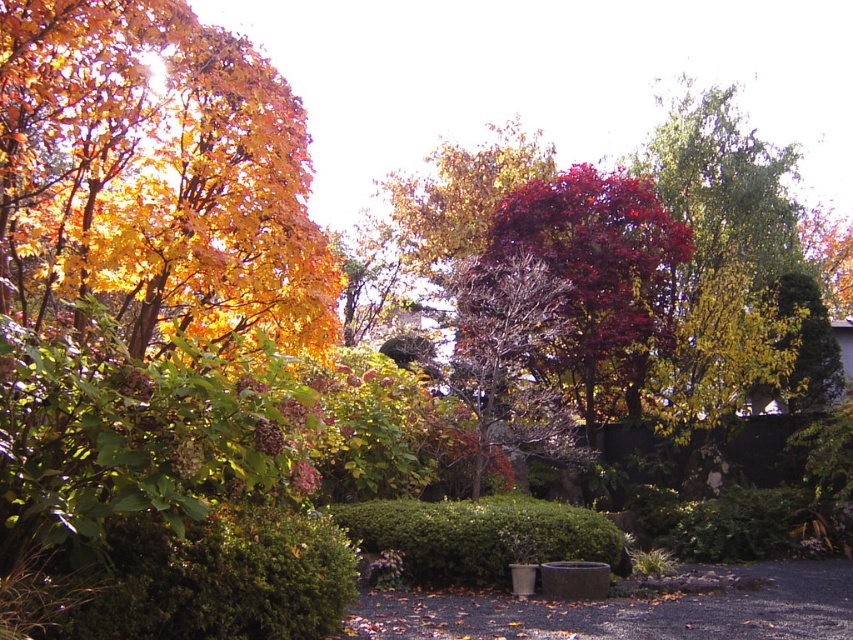
You are a gardener planning to install a new sprinkler system in the garden. The sprinkler has a maximum range of 10 feet. Given the green textured hedge at lower left and the green matte hedge at center, can the sprinkler effectively water both hedges without moving its position?

The green textured hedge at lower left and green matte hedge at center are 12.25 feet apart. Since the sprinkler has a maximum range of 10 feet, it cannot reach both hedges simultaneously from a single position. You would need to either move the sprinkler or install additional sprinklers to cover both areas.

You are designing a garden layout and need to place a tall statue. The statue requires a space where the green textured hedge at lower left and the green matte hedge at center are visible. Based on their heights, which hedge will block the view of the other if placed in front?

The green textured hedge at lower left is taller than the green matte hedge at center, so placing it in front would block the view of the green matte hedge at center.